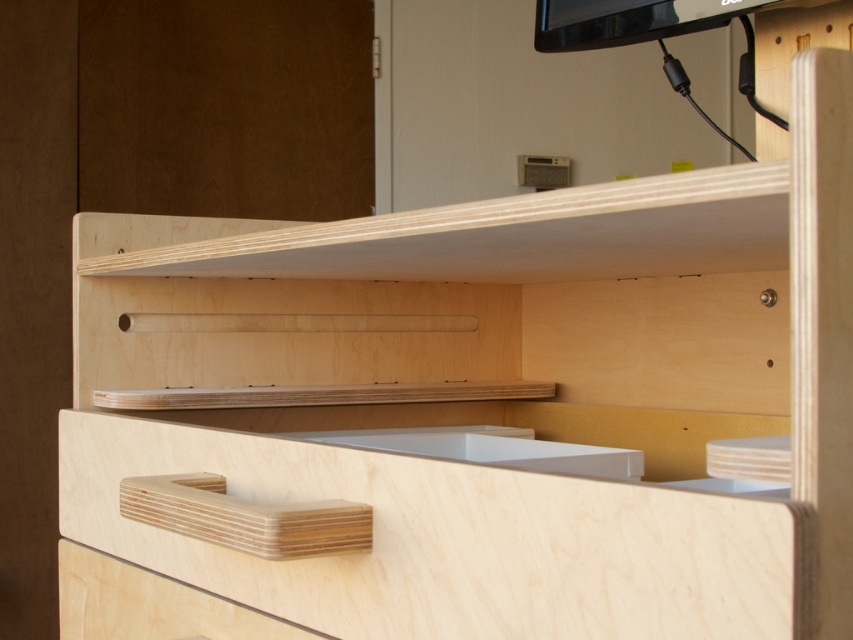
Based on the photo, you are organizing items in a kitchen and need to place a tall spice jar. Which object, the light wood drawer at lower left or the white matte sink at center, can accommodate the jar based on their heights?

The light wood drawer at lower left is taller than the white matte sink at center, so the spice jar can be placed in the light wood drawer at lower left.

You are a plumber working in a kitchen and need to access the pipes under the white matte sink at center. The natural wood drawer at lower center is blocking your path. Can you move the drawer to the side to reach the sink?

The natural wood drawer at lower center is in front of the white matte sink at center, so you can move the drawer to the side to access the pipes underneath the sink.

You are organizing a kitchen and need to place a 12 inch wide dish rack. You have a light wood drawer at lower left and a white matte sink at center. Which object can accommodate the dish rack based on their widths?

The white matte sink at center can accommodate the dish rack since its width is greater than the light wood drawer at lower left, which is too narrow for the 12 inch dish rack.